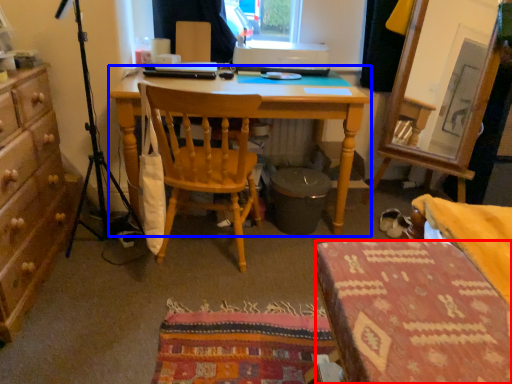
Question: Which object appears farthest to the camera in this image, stool (highlighted by a red box) or desk (highlighted by a blue box)?

Choices:
 (A) stool
 (B) desk

Answer: (B)